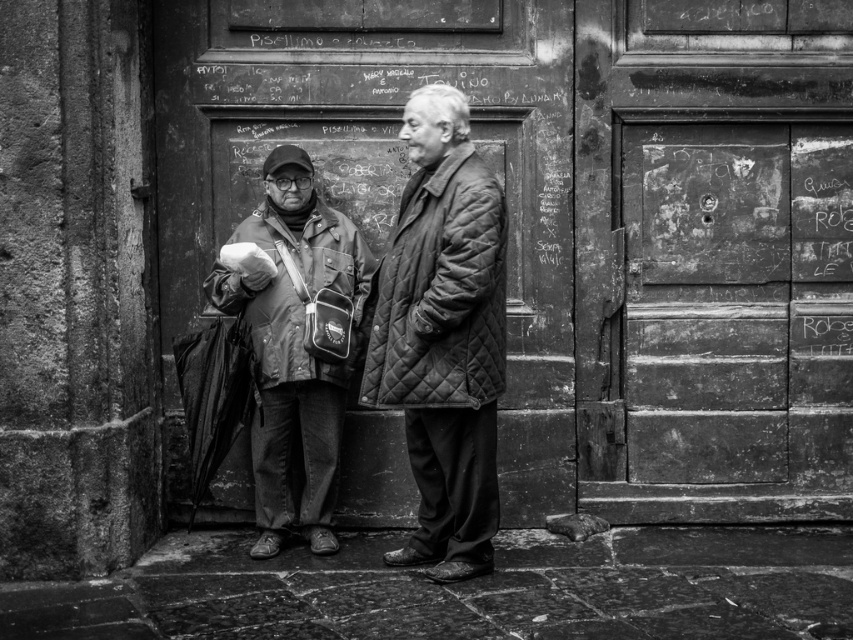
Question: Can you confirm if quilted fabric coat at center is bigger than quilted fabric jacket at center?

Choices:
 (A) yes
 (B) no

Answer: (B)

Question: Which object is farther from the camera taking this photo?

Choices:
 (A) quilted fabric coat at center
 (B) quilted fabric jacket at center

Answer: (B)

Question: Which object is positioned farthest from the quilted fabric coat at center?

Choices:
 (A) quilted fabric jacket at center
 (B) quilted leather jacket at center

Answer: (A)

Question: Can you confirm if quilted leather jacket at center is bigger than quilted fabric coat at center?

Choices:
 (A) yes
 (B) no

Answer: (A)

Question: Estimate the real-world distances between objects in this image. Which object is closer to the quilted leather jacket at center?

Choices:
 (A) quilted fabric coat at center
 (B) quilted fabric jacket at center

Answer: (A)

Question: Can you confirm if quilted leather jacket at center is bigger than quilted fabric coat at center?

Choices:
 (A) yes
 (B) no

Answer: (A)